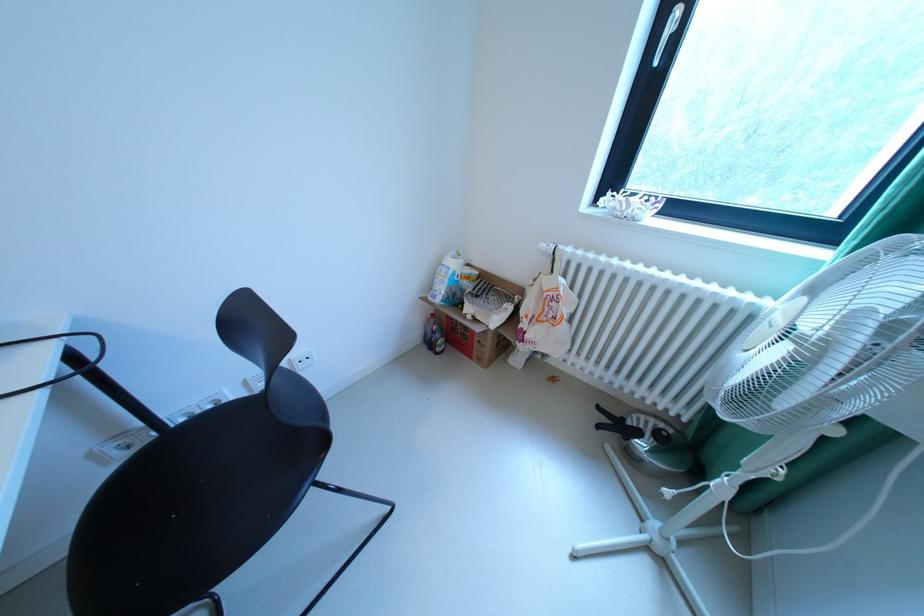
Describe the element at coordinates (548, 251) in the screenshot. I see `a radiator control knob` at that location.